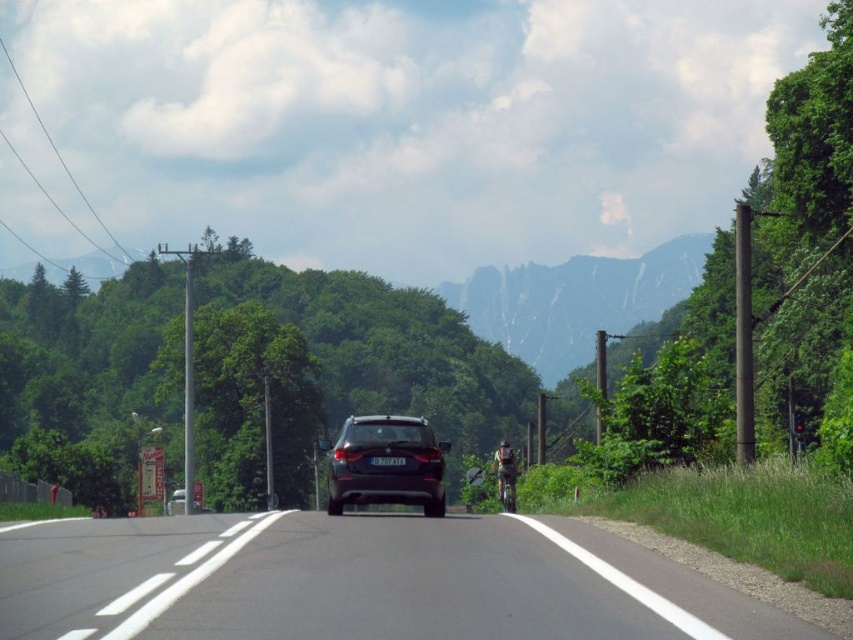
Question: Does satin black car at center lie in front of shiny metallic motorcycle at center?

Choices:
 (A) no
 (B) yes

Answer: (B)

Question: Which of these objects is positioned farthest from the black asphalt road at center?

Choices:
 (A) green fabric jacket at center
 (B) satin black car at center

Answer: (A)

Question: Which point is farther from the camera taking this photo?

Choices:
 (A) (222, 561)
 (B) (508, 481)

Answer: (B)

Question: Which point is closer to the camera?

Choices:
 (A) (358, 483)
 (B) (514, 497)

Answer: (A)

Question: Is black asphalt road at center to the left of green fabric jacket at center from the viewer's perspective?

Choices:
 (A) no
 (B) yes

Answer: (B)

Question: Observing the image, what is the correct spatial positioning of black asphalt road at center in reference to shiny metallic motorcycle at center?

Choices:
 (A) below
 (B) above

Answer: (B)